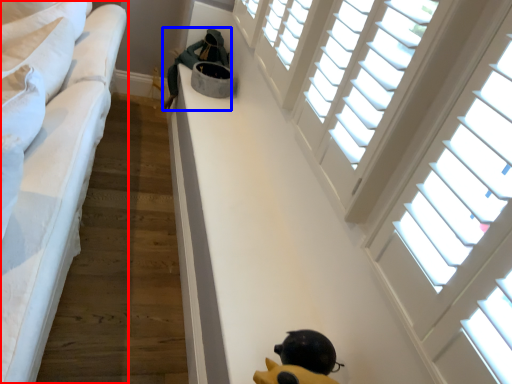
Question: Which point is further to the camera, furniture (highlighted by a red box) or person (highlighted by a blue box)?

Choices:
 (A) furniture
 (B) person

Answer: (B)